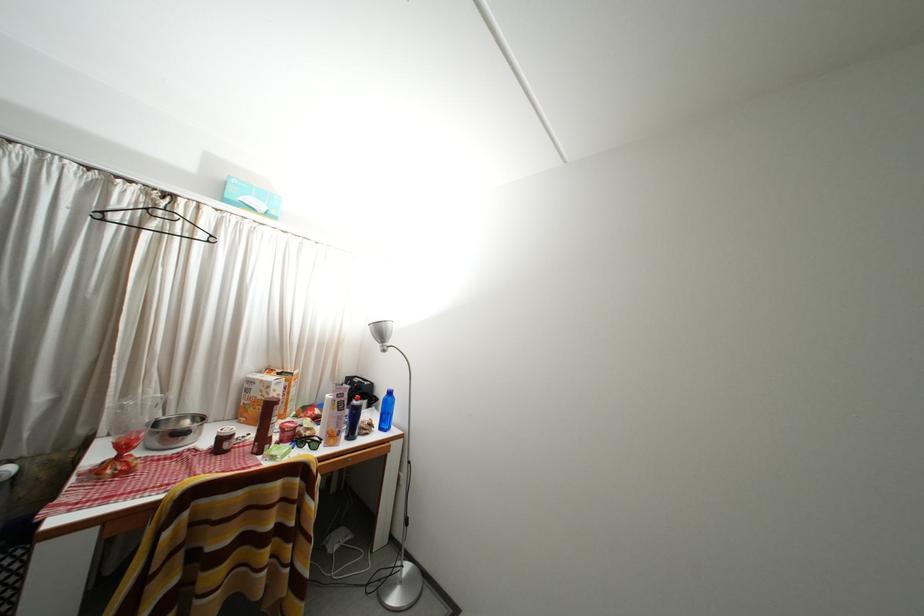
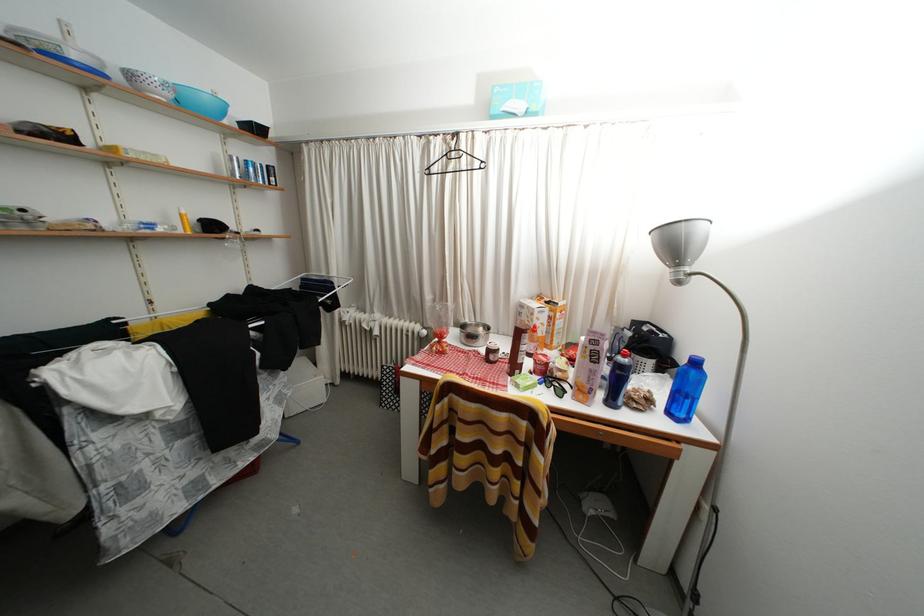
In the second image, find the point that corresponds to [388,338] in the first image.

(681, 251)